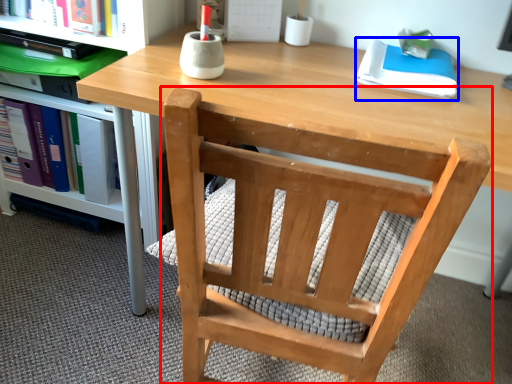
Question: Which of the following is the farthest to the observer, chair (highlighted by a red box) or paperback book (highlighted by a blue box)?

Choices:
 (A) chair
 (B) paperback book

Answer: (B)